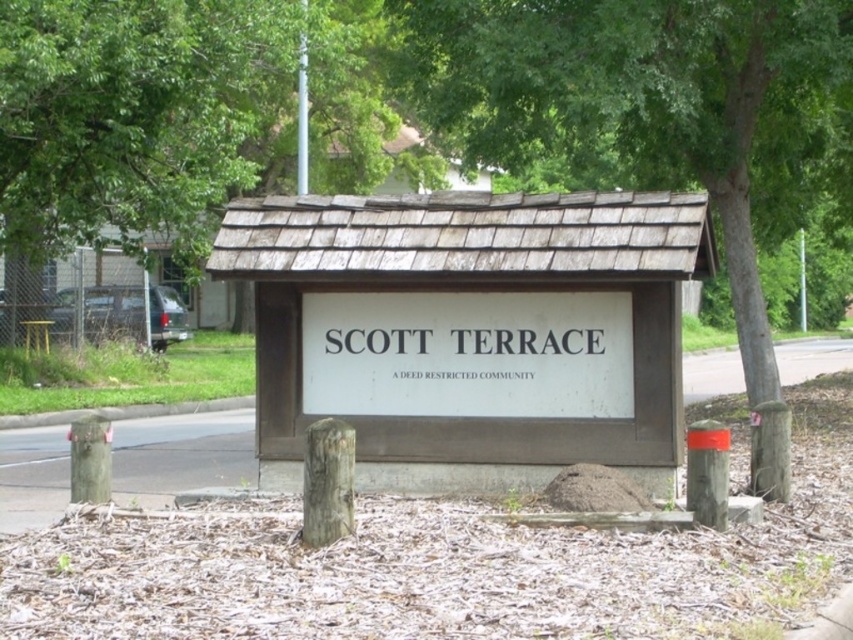
Question: Among these objects, which one is farthest from the camera?

Choices:
 (A) white wood sign at center
 (B) green leafy tree at upper center
 (C) green leafy tree at center
 (D) wooden sign at center

Answer: (B)

Question: Considering the relative positions of green leafy tree at center and white wood sign at center in the image provided, where is green leafy tree at center located with respect to white wood sign at center?

Choices:
 (A) above
 (B) below

Answer: (A)

Question: Is wooden sign at center positioned before white wood sign at center?

Choices:
 (A) yes
 (B) no

Answer: (A)

Question: Considering the relative positions of wooden sign at center and green leafy tree at center in the image provided, where is wooden sign at center located with respect to green leafy tree at center?

Choices:
 (A) left
 (B) right

Answer: (A)

Question: Which object is positioned farthest from the wooden sign at center?

Choices:
 (A) white wood sign at center
 (B) green leafy tree at upper center
 (C) green leafy tree at center

Answer: (B)

Question: Which of the following is the farthest from the observer?

Choices:
 (A) green leafy tree at upper center
 (B) wooden sign at center

Answer: (A)